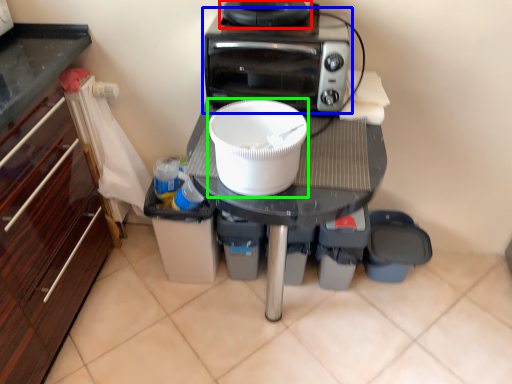
Question: Which object is positioned farthest from appliance (highlighted by a red box)? Select from home appliance (highlighted by a blue box) and kitchen appliance (highlighted by a green box).

Choices:
 (A) home appliance
 (B) kitchen appliance

Answer: (B)